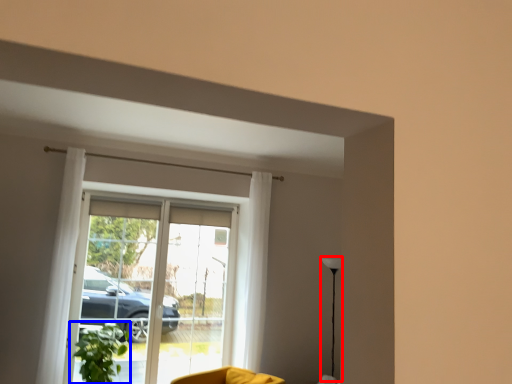
Question: Which object appears farthest to the camera in this image, lamp (highlighted by a red box) or houseplant (highlighted by a blue box)?

Choices:
 (A) lamp
 (B) houseplant

Answer: (A)